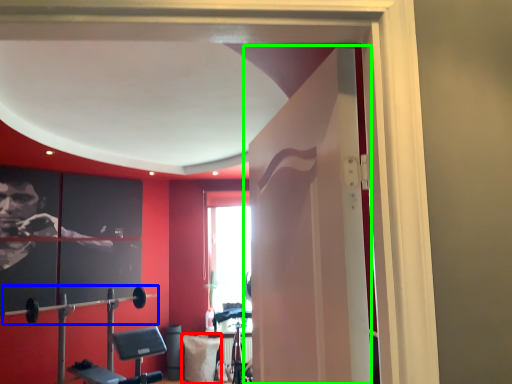
Question: Based on their relative distances, which object is nearer to pillow (highlighted by a red box)? Choose from barbell (highlighted by a blue box) and door (highlighted by a green box).

Choices:
 (A) barbell
 (B) door

Answer: (A)